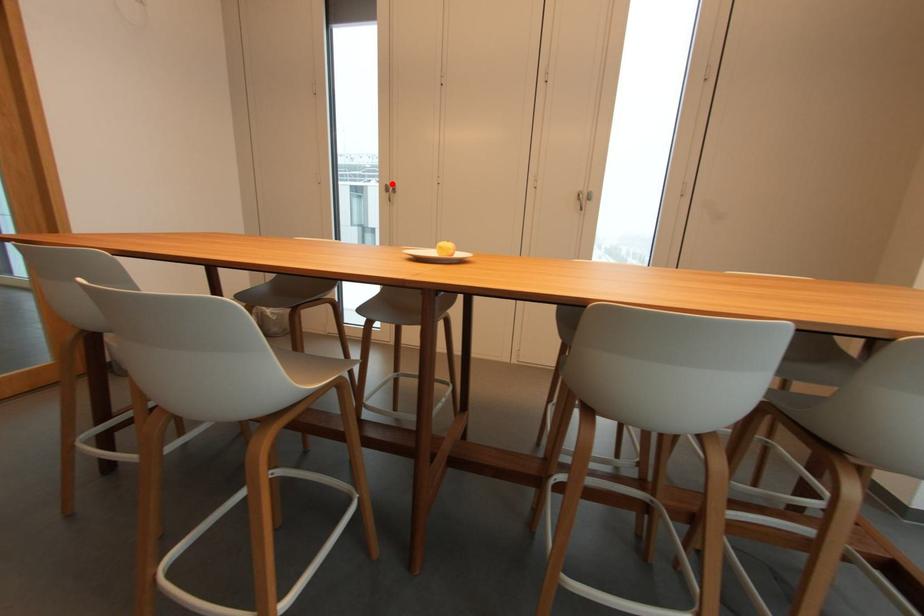
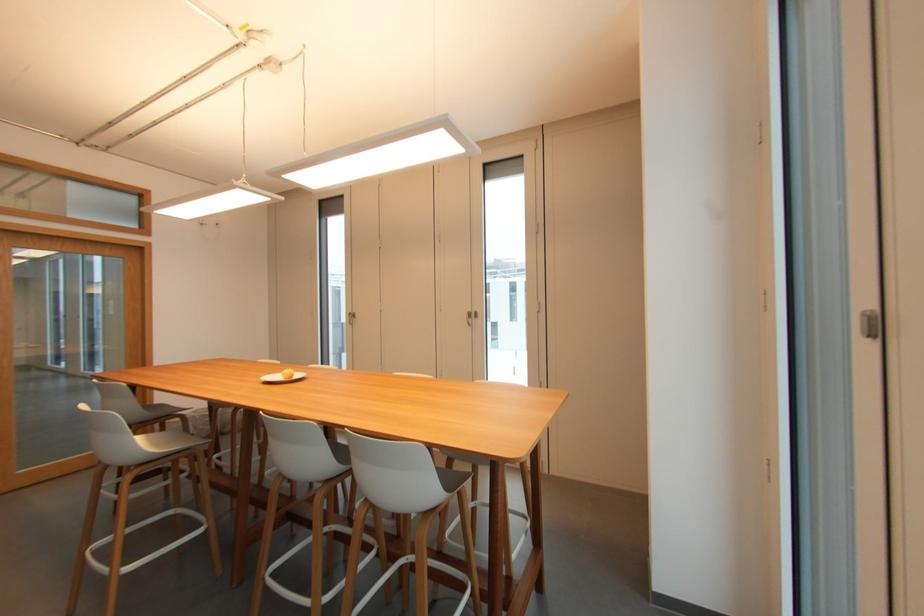
Locate, in the second image, the point that corresponds to the highlighted location in the first image.

(354, 312)